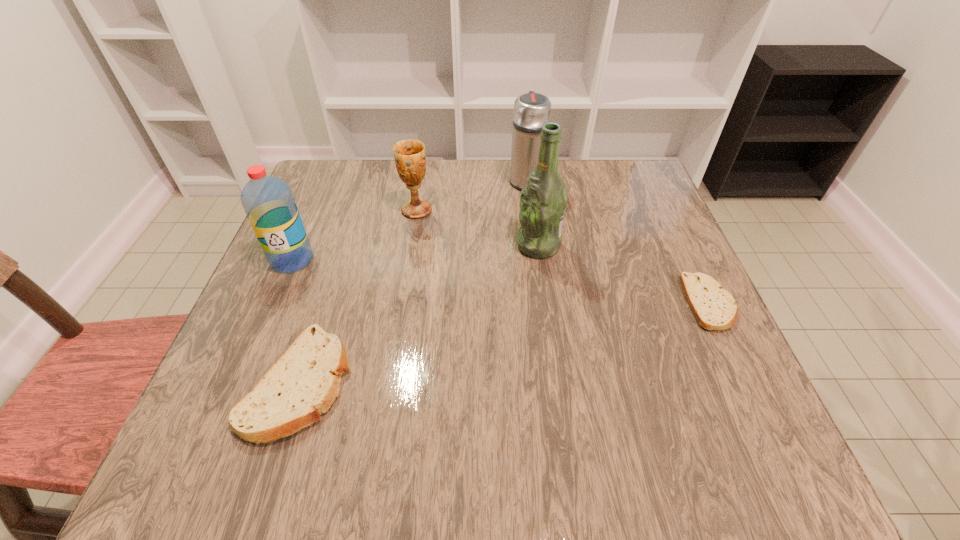
This screenshot has height=540, width=960. I want to click on vacant area that lies between the shortest object and the beer bottle, so click(624, 274).

In order to click on free point between the chalice and the left pita bread in this screenshot , I will do `click(358, 296)`.

What are the coordinates of `vacant area that lies between the beer bottle and the third object from left to right` in the screenshot? It's located at (477, 228).

Find the location of a particular element. The height and width of the screenshot is (540, 960). free area in between the thermos bottle and the left pita bread is located at coordinates (413, 281).

The image size is (960, 540). What are the coordinates of `empty location between the thermos bottle and the water bottle` in the screenshot? It's located at (409, 220).

Identify the location of blank region between the shortest object and the farthest object. (617, 241).

The width and height of the screenshot is (960, 540). I want to click on free area in between the farthest object and the left pita bread, so click(x=413, y=281).

Find the location of a particular element. The image size is (960, 540). free space between the rightmost object and the tallest object is located at coordinates (624, 274).

Where is `object that is the second closest one to the third object from left to right`? object that is the second closest one to the third object from left to right is located at coordinates (532, 110).

At what (x,y) coordinates should I click in order to perform the action: click on object that is the second closest one to the tallest object. Please return your answer as a coordinate pair (x, y). The image size is (960, 540). Looking at the image, I should click on (410, 159).